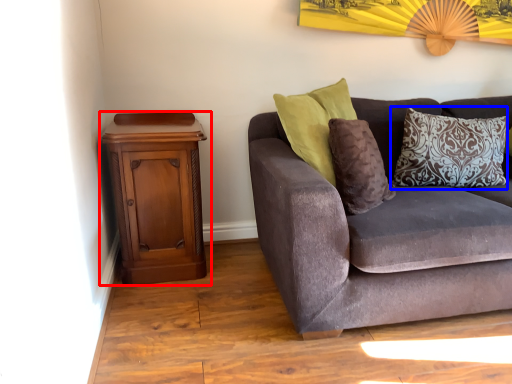
Question: Which object appears farthest to the camera in this image, nightstand (highlighted by a red box) or pillow (highlighted by a blue box)?

Choices:
 (A) nightstand
 (B) pillow

Answer: (B)